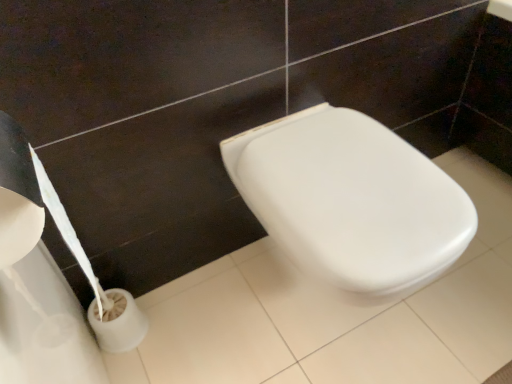
The image size is (512, 384). Identify the location of blank space to the left of white glossy toilet at center. (212, 322).